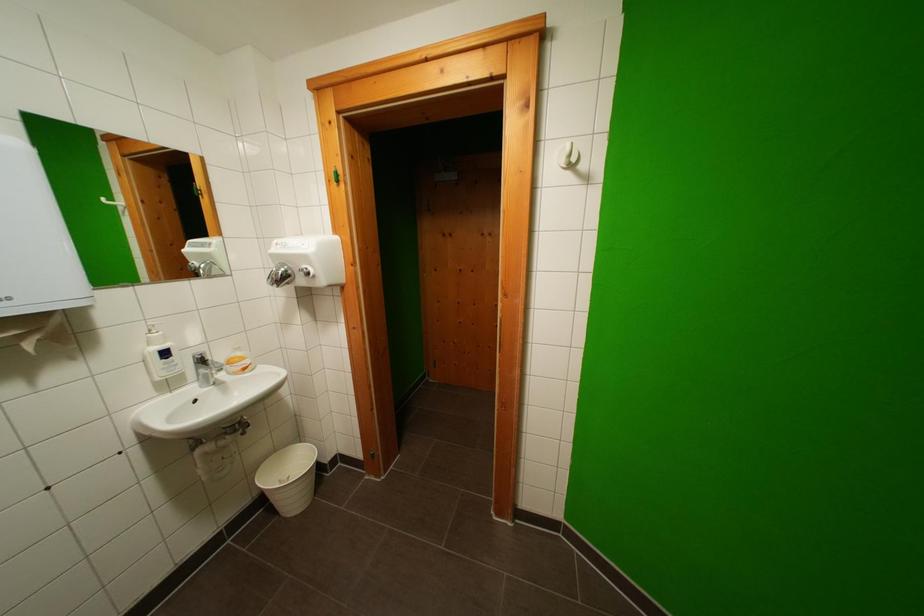
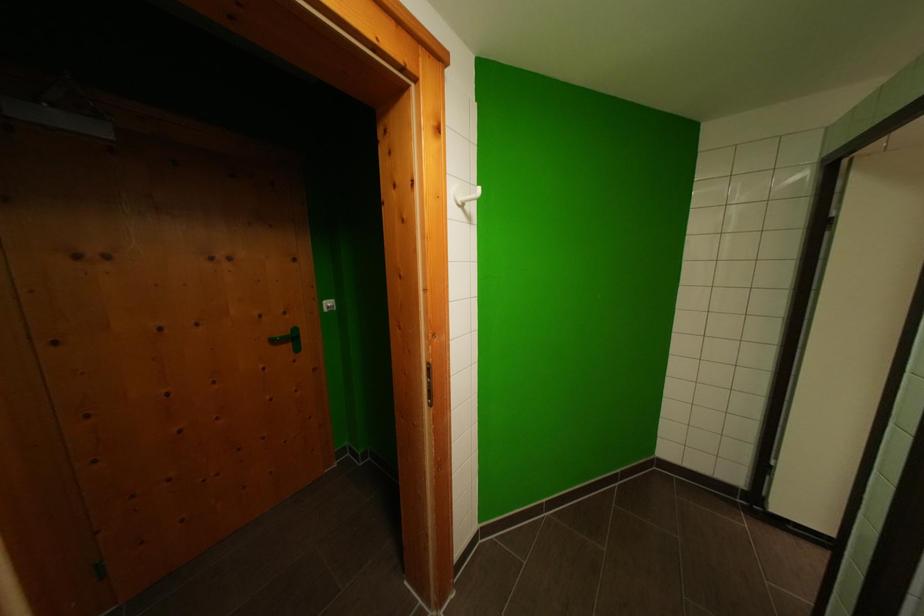
Question: The camera is either moving clockwise (left) or counter-clockwise (right) around the object. The first image is from the beginning of the video and the second image is from the end. Is the camera moving left or right when shooting the video?

Choices:
 (A) Left
 (B) Right

Answer: (A)